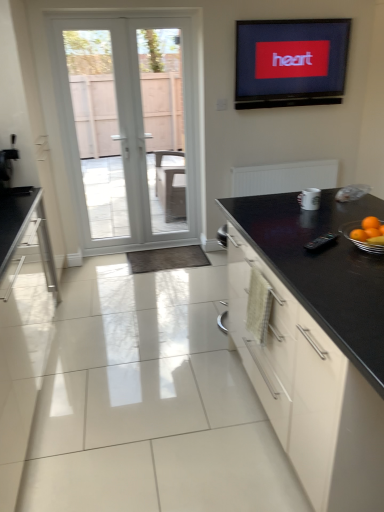
I want to click on blank area to the left of white ceramic mug at upper right, positioned as the first appliance in top-to-bottom order, so click(x=283, y=207).